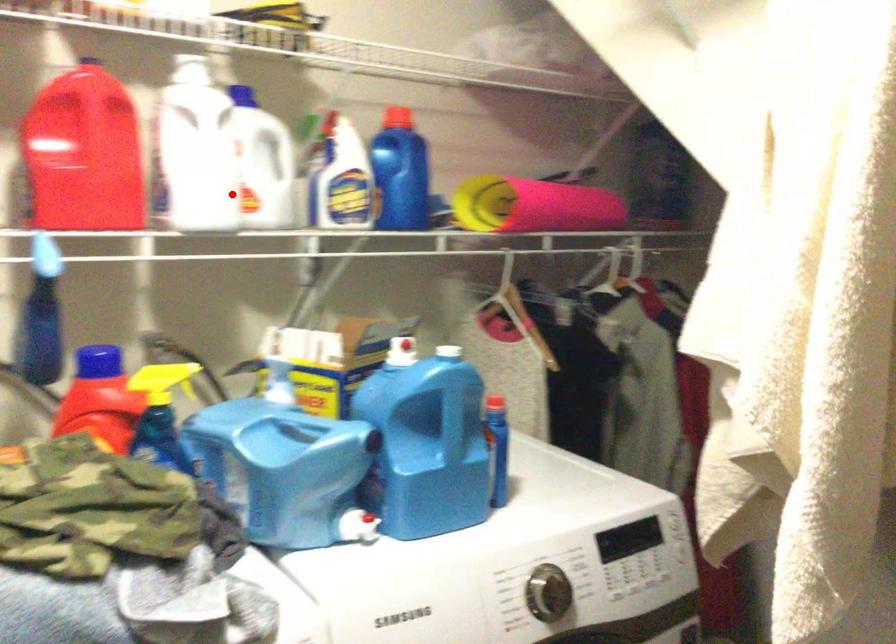
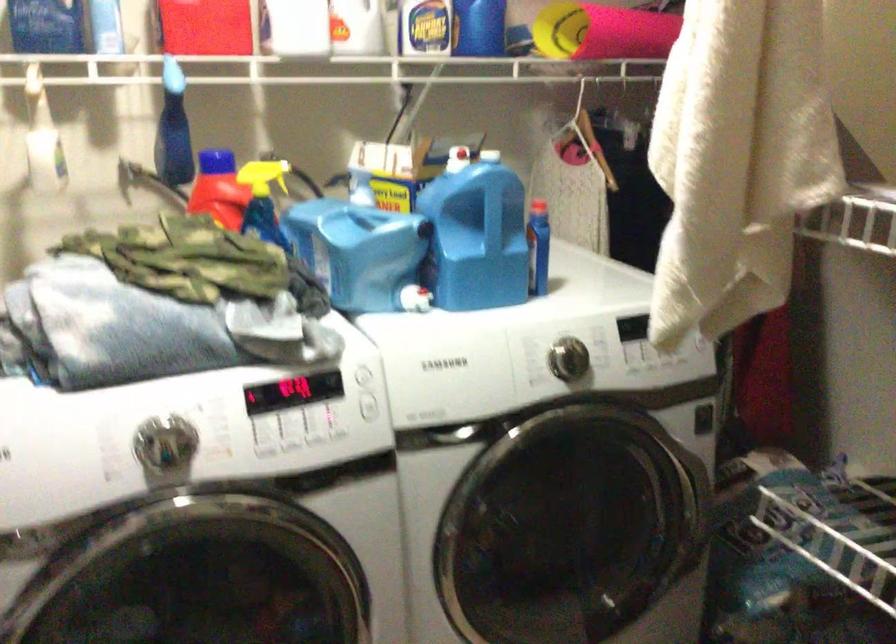
Question: I am providing you with two images of the same scene from different viewpoints. A red point is shown in image1. For the corresponding object point in image2, is it positioned nearer or farther from the camera?

Choices:
 (A) Nearer
 (B) Farther

Answer: (B)